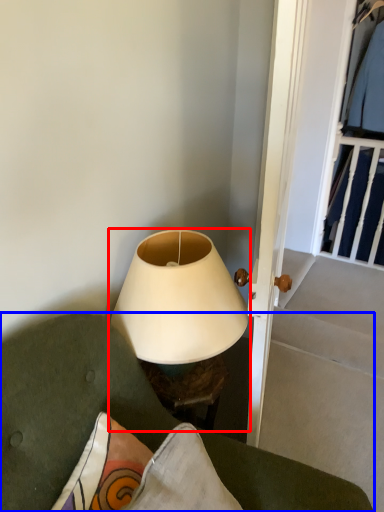
Question: Which object appears farthest to the camera in this image, lamp (highlighted by a red box) or furniture (highlighted by a blue box)?

Choices:
 (A) lamp
 (B) furniture

Answer: (A)